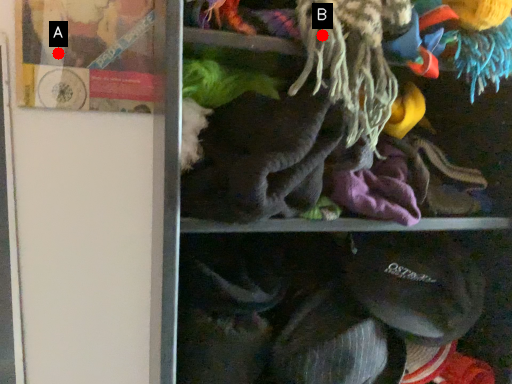
Question: Two points are circled on the image, labeled by A and B beside each circle. Among these points, which one is nearest to the camera?

Choices:
 (A) A is closer
 (B) B is closer

Answer: (B)